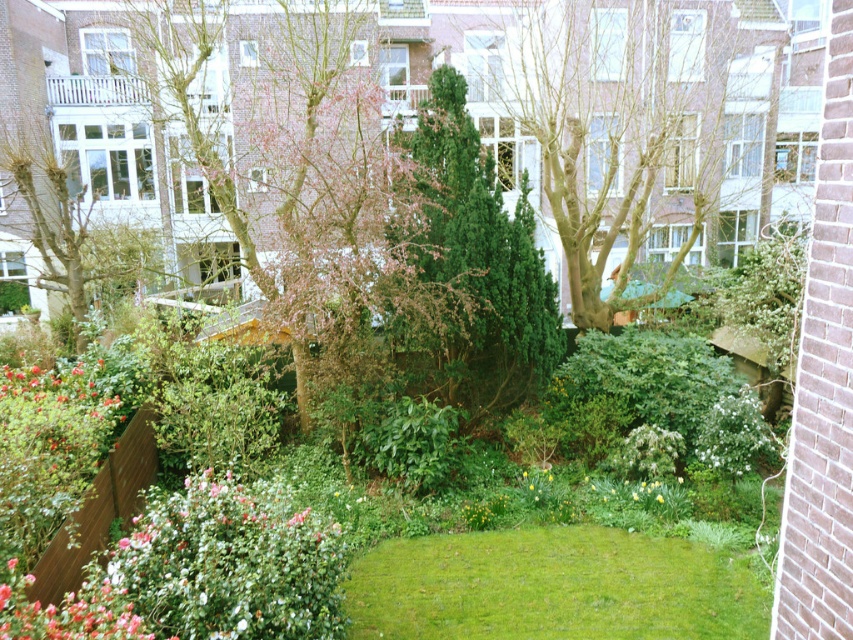
Question: Among these objects, which one is farthest from the camera?

Choices:
 (A) bare brown tree at center
 (B) green leafy tree at center
 (C) green grass at center

Answer: (A)

Question: Among these objects, which one is farthest from the camera?

Choices:
 (A) green grass at center
 (B) pink matte flowers at lower left
 (C) bare brown tree at center

Answer: (C)

Question: Among these objects, which one is farthest from the camera?

Choices:
 (A) smooth brown tree at center
 (B) green grass at center
 (C) bright pink petals at lower left

Answer: (A)

Question: Can you confirm if bare brown tree at center is positioned to the left of smooth brown tree at center?

Choices:
 (A) no
 (B) yes

Answer: (A)

Question: Is bare brown tree at center closer to the viewer compared to green grass at center?

Choices:
 (A) yes
 (B) no

Answer: (B)

Question: Does green textured bush at center come in front of white matte flower at center?

Choices:
 (A) no
 (B) yes

Answer: (A)